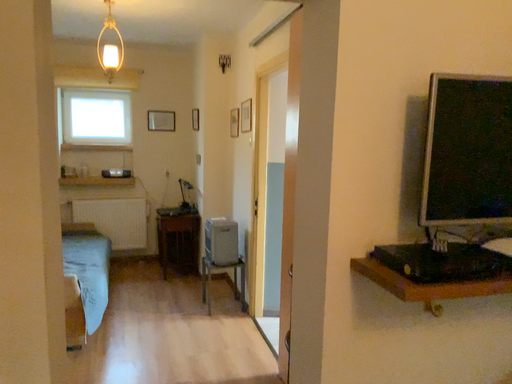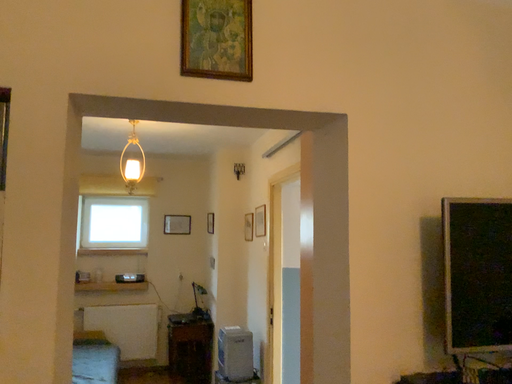
Question: How did the camera likely rotate when shooting the video?

Choices:
 (A) rotated downward
 (B) rotated upward

Answer: (B)